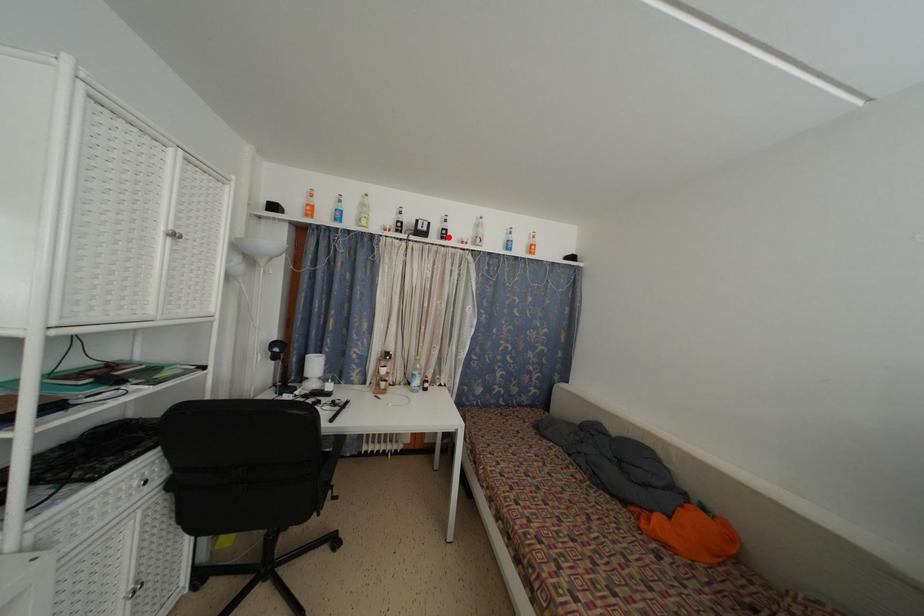
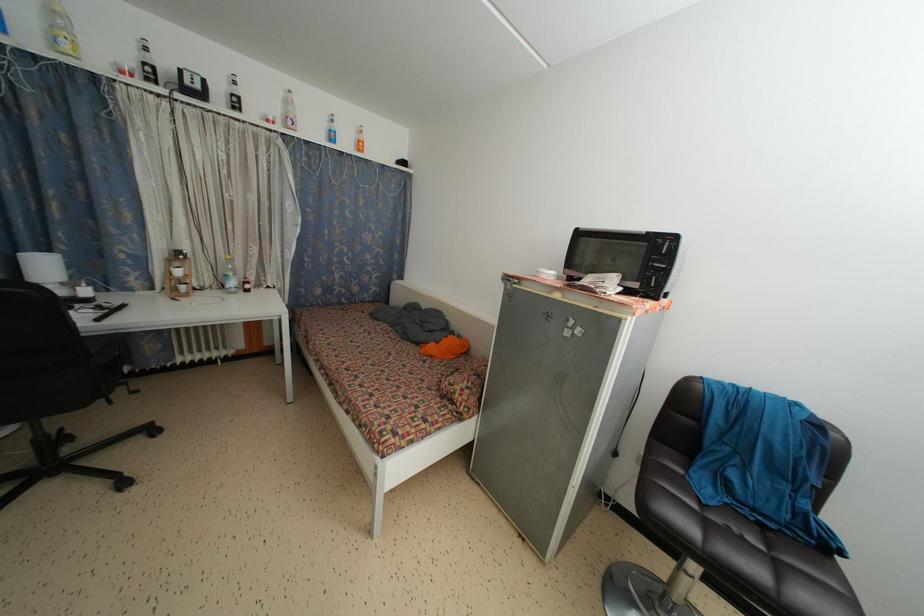
Where in the second image is the point corresponding to the highlighted location from the first image?

(238, 105)